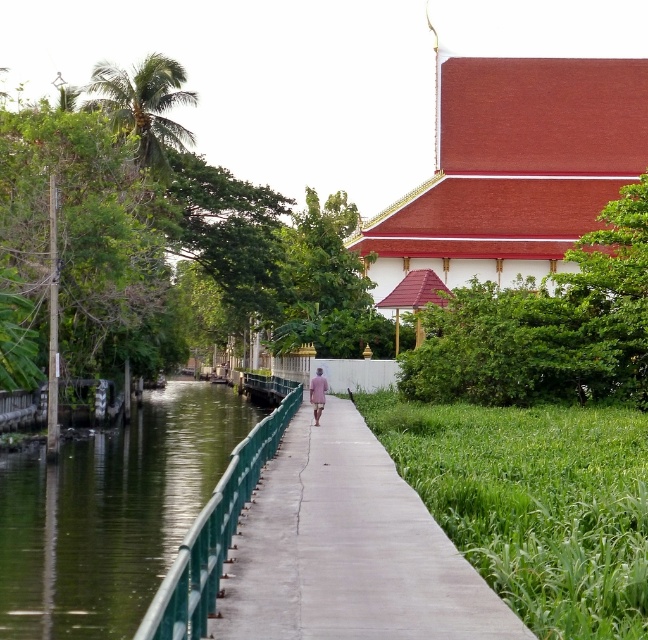
Question: Among these points, which one is farthest from the camera?

Choices:
 (A) (319, 385)
 (B) (209, 561)
 (C) (154, 417)

Answer: (C)

Question: Is green metallic railing at lower left below pink fabric at center?

Choices:
 (A) no
 (B) yes

Answer: (B)

Question: Where is green metal/rail at center located in relation to pink fabric at center in the image?

Choices:
 (A) above
 (B) below

Answer: (B)

Question: Can you confirm if green metal/rail at center is thinner than pink fabric at center?

Choices:
 (A) yes
 (B) no

Answer: (B)

Question: Among these objects, which one is nearest to the camera?

Choices:
 (A) pink fabric at center
 (B) green metal/rail at center
 (C) green metallic railing at lower left

Answer: (B)

Question: Which is nearer to the green metallic railing at lower left?

Choices:
 (A) green metal/rail at center
 (B) pink fabric at center

Answer: (A)